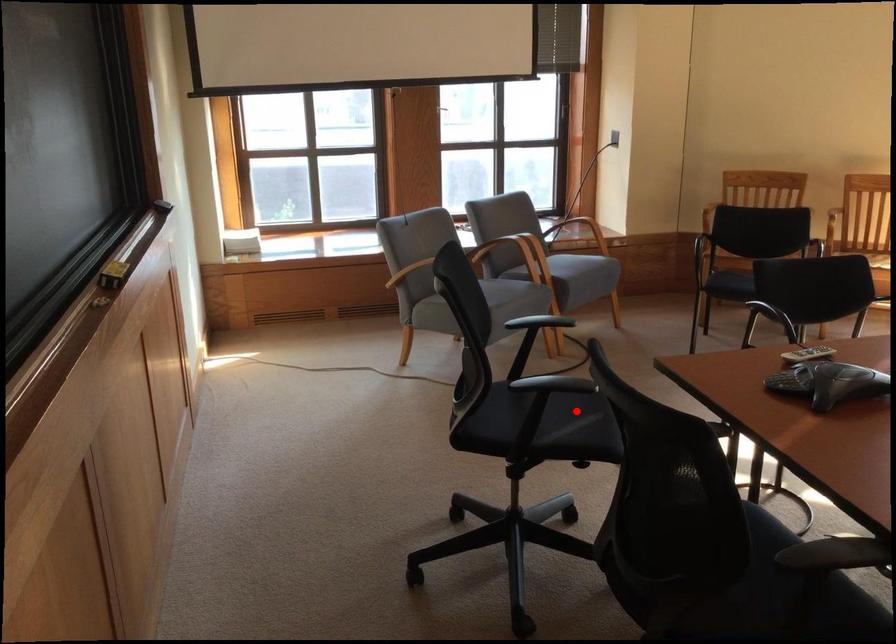
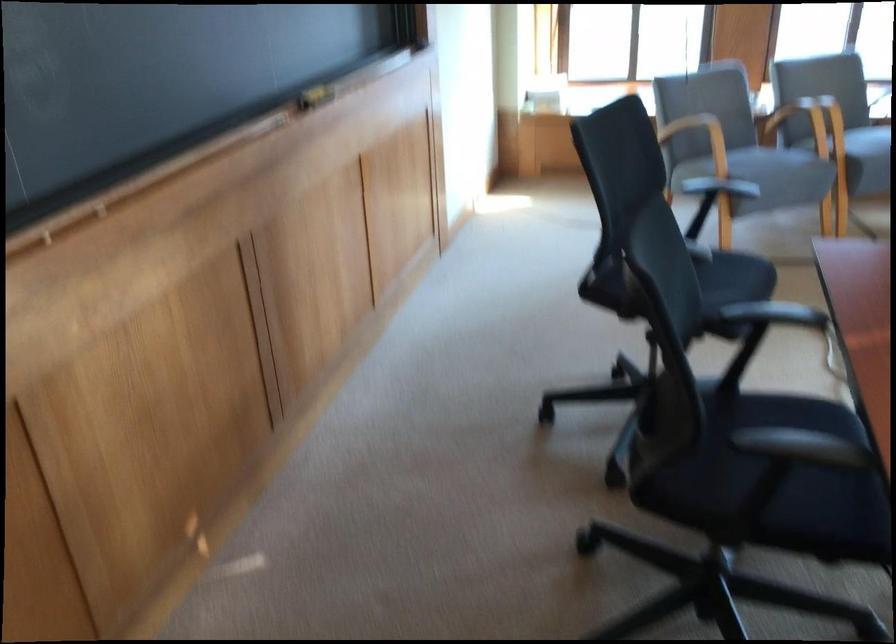
Find the pixel in the second image that matches the highlighted location in the first image.

(717, 285)